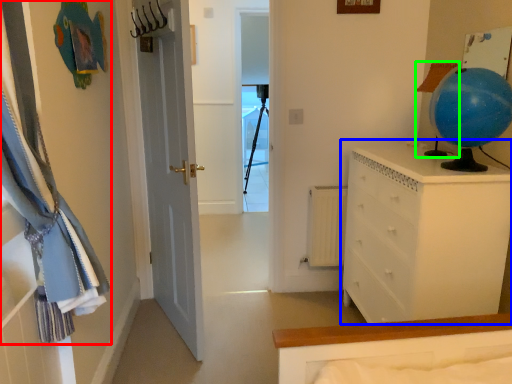
Question: Which object is positioned farthest from curtain (highlighted by a red box)? Select from chest of drawers (highlighted by a blue box) and lamp (highlighted by a green box).

Choices:
 (A) chest of drawers
 (B) lamp

Answer: (B)